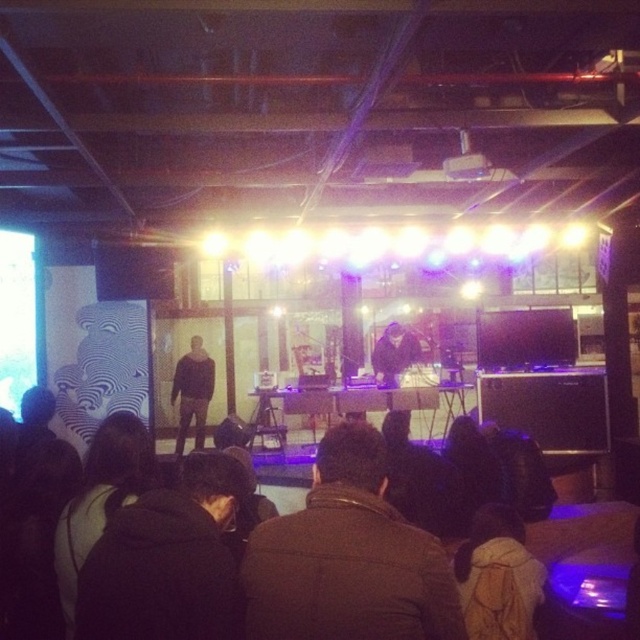
Does black fuzzy jacket at lower center appear on the right side of dark brown sweater at center?

Indeed, black fuzzy jacket at lower center is positioned on the right side of dark brown sweater at center.

This screenshot has width=640, height=640. Find the location of `black fuzzy jacket at lower center`. black fuzzy jacket at lower center is located at coordinates (168, 561).

Who is positioned more to the left, brown backpack at lower right or dark fabric jacket at center?

From the viewer's perspective, brown backpack at lower right appears more on the left side.

Who is shorter, brown backpack at lower right or dark fabric jacket at center?

With less height is brown backpack at lower right.

Which is behind, point (516, 588) or point (387, 332)?

Point (387, 332)

You are a GUI agent. You are given a task and a screenshot of the screen. Output one action in this format:
    pyautogui.click(x=<x>, y=<y>)
    Task: Click on the brown backpack at lower right
    This screenshot has height=640, width=640.
    Given the screenshot: What is the action you would take?
    pyautogui.click(x=497, y=577)

Who is shorter, dark fabric jacket at lower left or brown backpack at lower right?

brown backpack at lower right

Is dark fabric jacket at lower left to the left of brown backpack at lower right from the viewer's perspective?

Indeed, dark fabric jacket at lower left is positioned on the left side of brown backpack at lower right.

Does point (108, 506) come farther from viewer compared to point (483, 628)?

No, (108, 506) is in front of (483, 628).

Where is `dark fabric jacket at lower left`? This screenshot has height=640, width=640. dark fabric jacket at lower left is located at coordinates (100, 497).